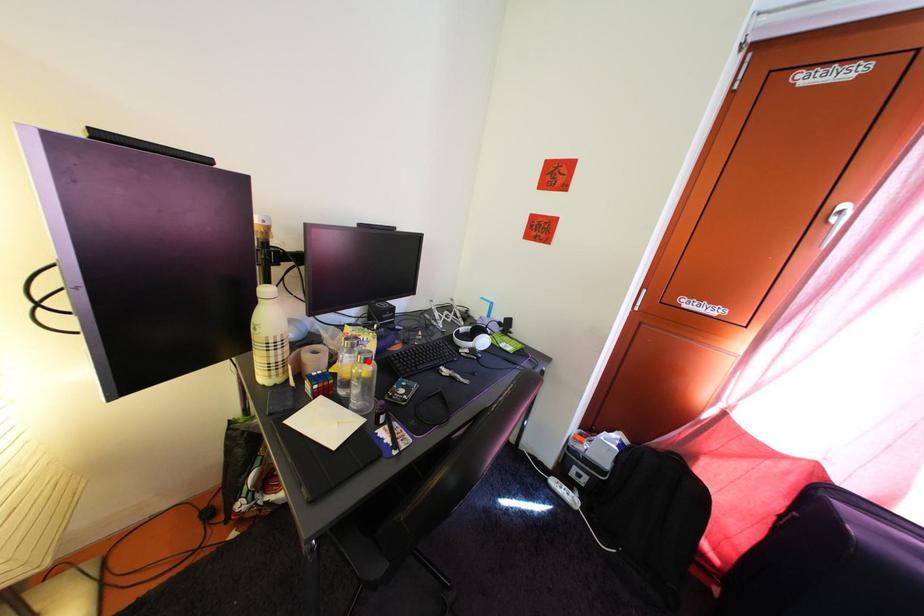
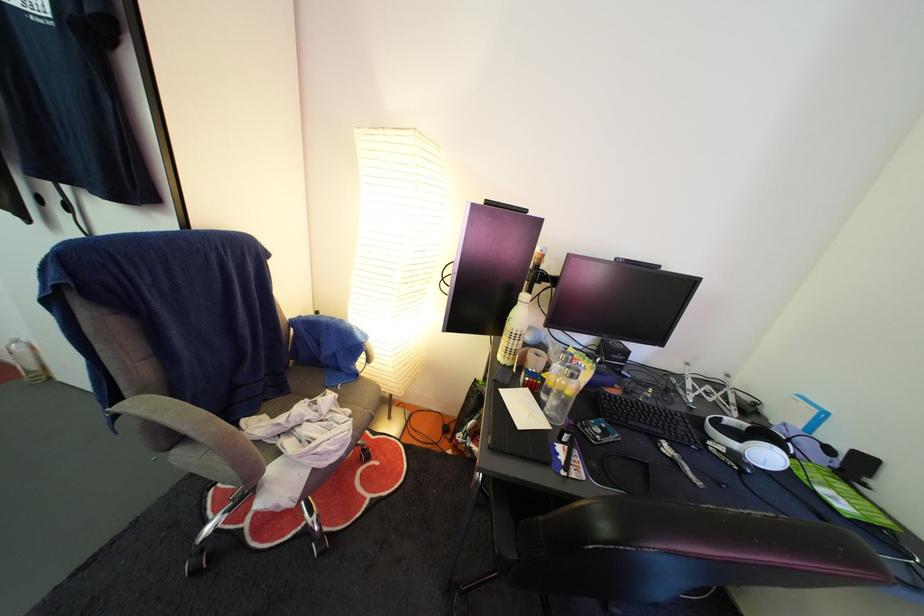
The point at the highlighted location is marked in the first image. Where is the corresponding point in the second image?

(578, 376)